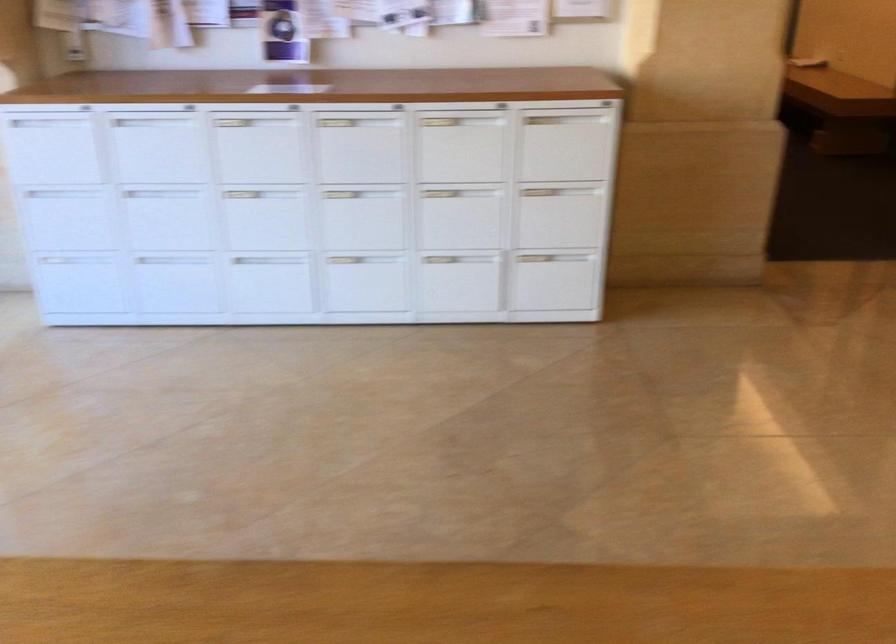
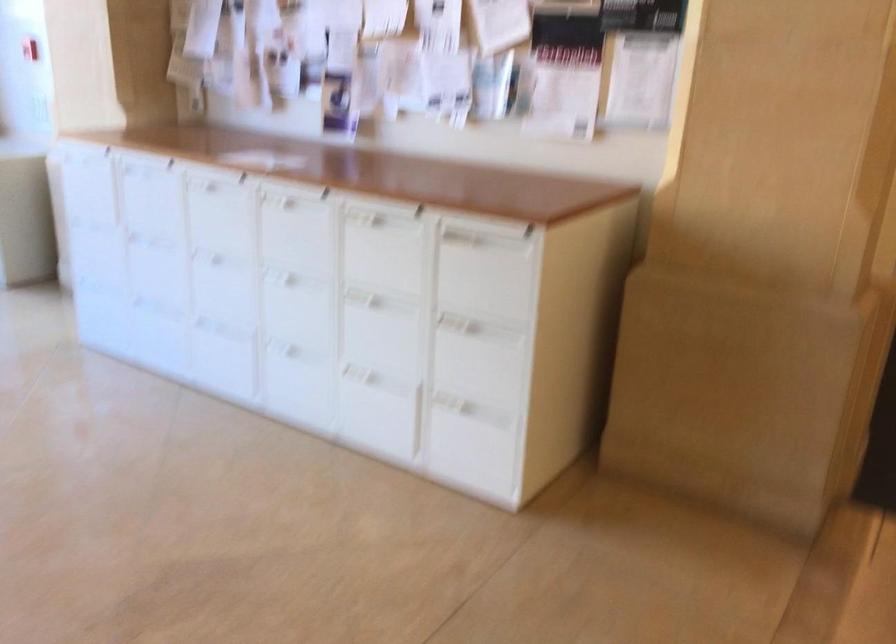
Where in the second image is the point corresponding to point (567, 134) from the first image?

(487, 269)